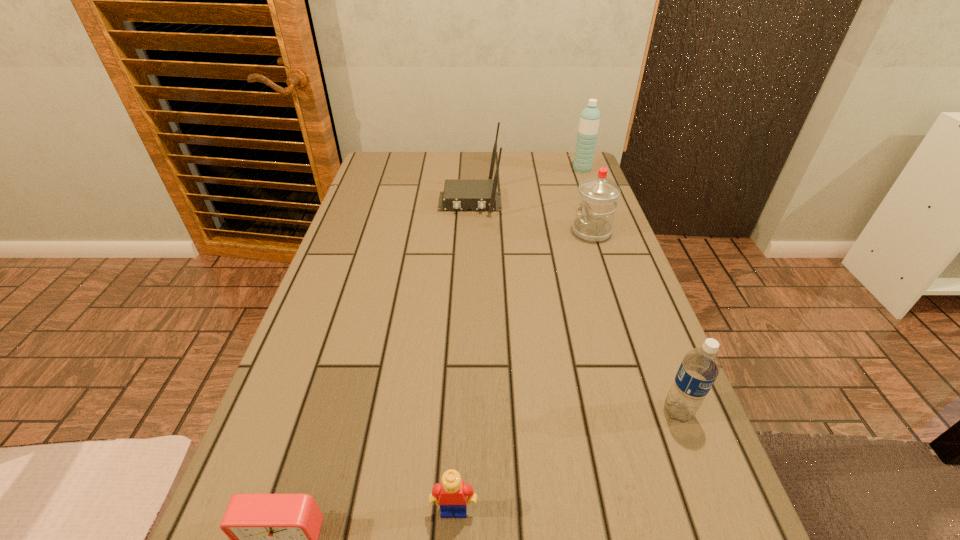
In order to click on free space between the third nearest object and the farthest object in this screenshot , I will do `click(630, 291)`.

You are a GUI agent. You are given a task and a screenshot of the screen. Output one action in this format:
    pyautogui.click(x=<x>, y=<y>)
    Task: Click on the free spot between the Lego and the third farthest object
    Image resolution: width=960 pixels, height=540 pixels.
    Given the screenshot: What is the action you would take?
    pyautogui.click(x=522, y=371)

Image resolution: width=960 pixels, height=540 pixels. I want to click on vacant point located between the tallest water bottle and the router, so click(526, 186).

Find the location of a particular element. The image size is (960, 540). object that is the fifth nearest to the Lego is located at coordinates (589, 121).

Identify which object is located as the nearest to the fifth nearest object. Please provide its 2D coordinates. Your answer should be formatted as a tuple, i.e. [(x, y)], where the tuple contains the x and y coordinates of a point satisfying the conditions above.

[(598, 196)]

Select which water bottle appears as the second closest to the second shortest object. Please provide its 2D coordinates. Your answer should be formatted as a tuple, i.e. [(x, y)], where the tuple contains the x and y coordinates of a point satisfying the conditions above.

[(598, 196)]

You are a GUI agent. You are given a task and a screenshot of the screen. Output one action in this format:
    pyautogui.click(x=<x>, y=<y>)
    Task: Click on the closest water bottle to the fourth nearest object
    The image size is (960, 540).
    Given the screenshot: What is the action you would take?
    pyautogui.click(x=589, y=121)

The width and height of the screenshot is (960, 540). Identify the location of free spot that satisfies the following two spatial constraints: 1. on the back of the second farthest object to connect cables; 2. on the right side of the nearest water bottle. tap(463, 411).

This screenshot has height=540, width=960. I want to click on free space that satisfies the following two spatial constraints: 1. on the back of the nearest water bottle to connect cables; 2. on the right side of the router, so click(x=463, y=411).

The width and height of the screenshot is (960, 540). I want to click on blank space that satisfies the following two spatial constraints: 1. on the back side of the nearest water bottle; 2. on the handle side of the second nearest water bottle, so click(610, 232).